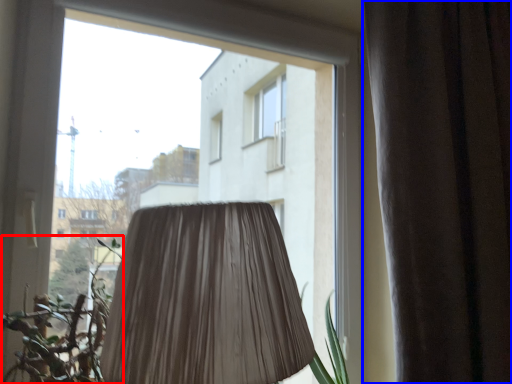
Question: Which point is closer to the camera, vegetation (highlighted by a red box) or curtain (highlighted by a blue box)?

Choices:
 (A) vegetation
 (B) curtain

Answer: (A)